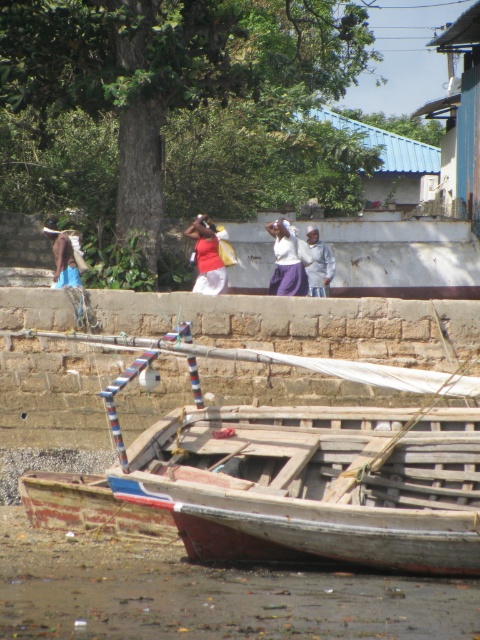
You are a photographer trying to capture a group photo of the people by the riverside. You notice two individuals wearing a white matte shirt at center and a brown leather jacket at left. Based on their positions, which person should you ask to move slightly to the left to create more space between them?

The white matte shirt at center is positioned on the right side of the brown leather jacket at left. Therefore, you should ask the person in the white matte shirt at center to move slightly to the left to create more space between them.

You are a photographer trying to capture both the white matte shirt at center and the matte red shirt at center in the same frame. Which shirt should you focus on to ensure both are in the frame without moving the camera?

The white matte shirt at center is smaller than the matte red shirt at center, so focusing on the matte red shirt at center would help ensure both are in the frame since it is larger and easier to capture while the smaller white one remains visible.